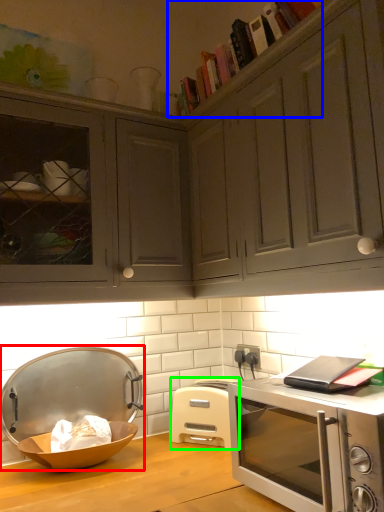
Question: Considering the real-world distances, which object is farthest from appliance (highlighted by a red box)? book (highlighted by a blue box) or toaster (highlighted by a green box)?

Choices:
 (A) book
 (B) toaster

Answer: (A)